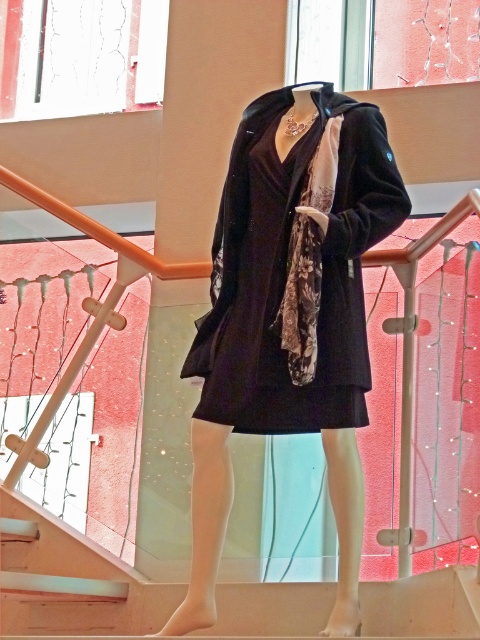
Question: Among these points, which one is nearest to the camera?

Choices:
 (A) (285, 596)
 (B) (291, 243)
 (C) (313, 356)

Answer: (C)

Question: Estimate the real-world distances between objects in this image. Which object is farther from the floral silk scarf at center?

Choices:
 (A) white glossy stairs at lower center
 (B) velvet black coat at center

Answer: (A)

Question: Which object is positioned closest to the velvet black coat at center?

Choices:
 (A) floral silk scarf at center
 (B) white glossy stairs at lower center

Answer: (A)

Question: Where is velvet black coat at center located in relation to white glossy stairs at lower center in the image?

Choices:
 (A) right
 (B) left

Answer: (A)

Question: Where is velvet black coat at center located in relation to floral silk scarf at center in the image?

Choices:
 (A) above
 (B) below

Answer: (B)

Question: In this image, where is velvet black coat at center located relative to white glossy stairs at lower center?

Choices:
 (A) right
 (B) left

Answer: (A)